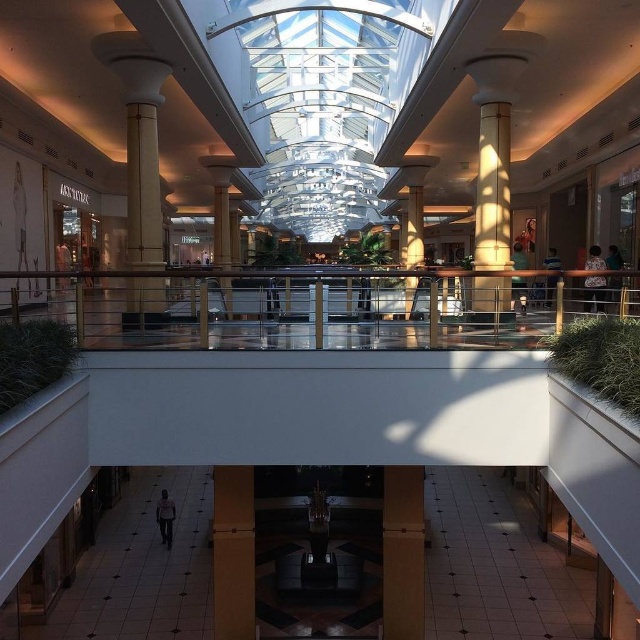
Question: Which object appears farthest from the camera in this image?

Choices:
 (A) smooth beige column at center
 (B) brown matte pillar at lower center
 (C) wooden pillar at center

Answer: (A)

Question: Which object is positioned closest to the brown matte pillar at lower center?

Choices:
 (A) metallic polished rail at center
 (B) matte gold column at center

Answer: (A)

Question: Can you confirm if metallic polished rail at center is wider than smooth beige column at center?

Choices:
 (A) no
 (B) yes

Answer: (B)

Question: Does metallic polished rail at center lie behind smooth beige column at center?

Choices:
 (A) yes
 (B) no

Answer: (B)

Question: Which object is farther from the camera taking this photo?

Choices:
 (A) brown matte pillar at lower center
 (B) wooden pillar at center

Answer: (B)

Question: Can you confirm if metallic polished rail at center is wider than matte gold column at center?

Choices:
 (A) yes
 (B) no

Answer: (A)